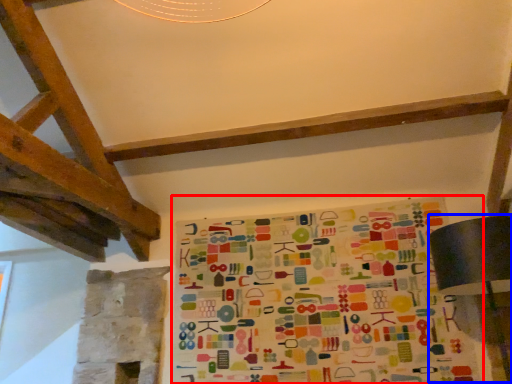
Question: Which point is further to the camera, bulletin board (highlighted by a red box) or table lamp (highlighted by a blue box)?

Choices:
 (A) bulletin board
 (B) table lamp

Answer: (A)